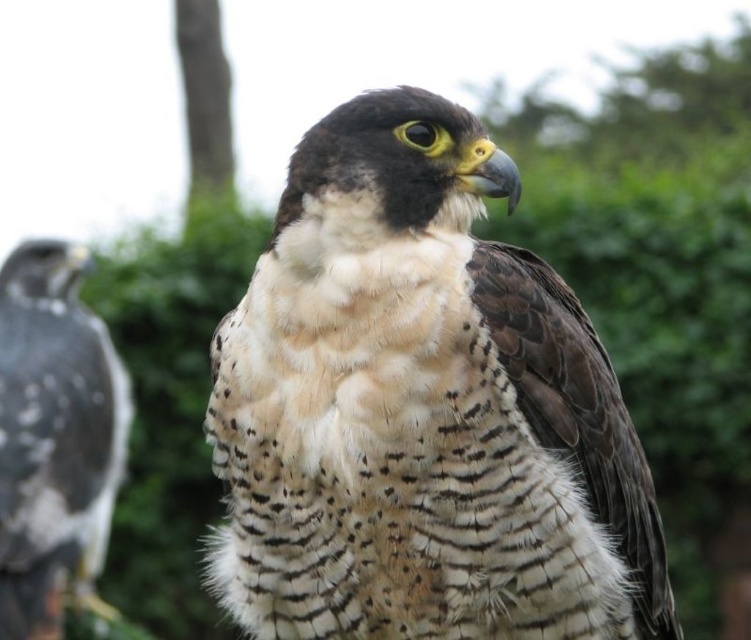
From the picture: You are observing a peregrine falcon and notice two points marked on its body. From your perspective, which point is closer to you, point (17, 342) or point (228, 172)?

Point (17, 342) is closer to the viewer than point (228, 172).